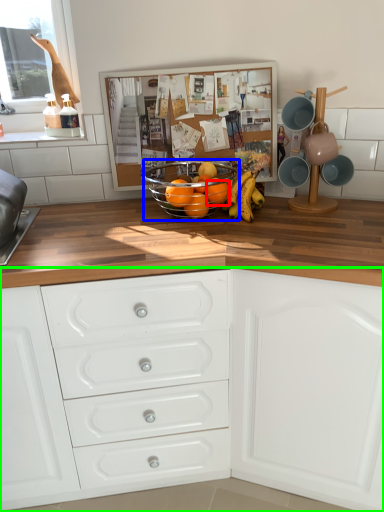
Question: Estimate the real-world distances between objects in this image. Which object is closer to orange (highlighted by a red box), glass bowl (highlighted by a blue box) or chest of drawers (highlighted by a green box)?

Choices:
 (A) glass bowl
 (B) chest of drawers

Answer: (A)